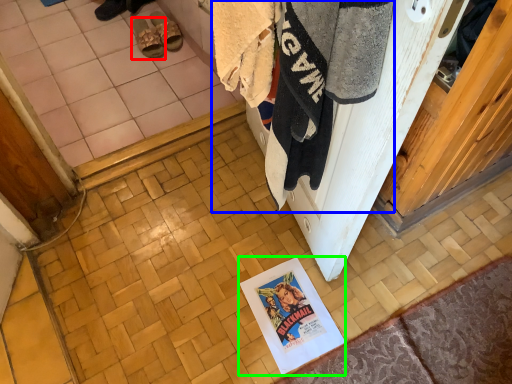
Question: Which object is positioned farthest from footwear (highlighted by a red box)? Select from laundry (highlighted by a blue box) and poster page (highlighted by a green box).

Choices:
 (A) laundry
 (B) poster page

Answer: (A)